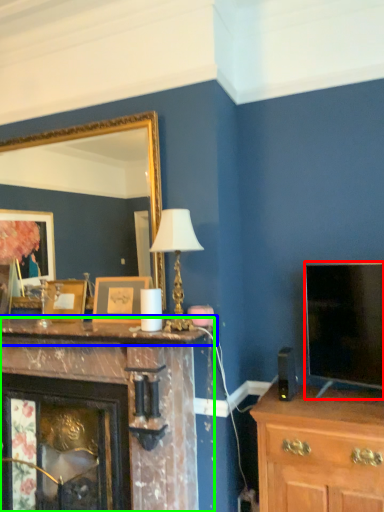
Question: Which object is the closest to the television (highlighted by a red box)? Choose among these: mantle (highlighted by a blue box) or fireplace (highlighted by a green box).

Choices:
 (A) mantle
 (B) fireplace

Answer: (A)